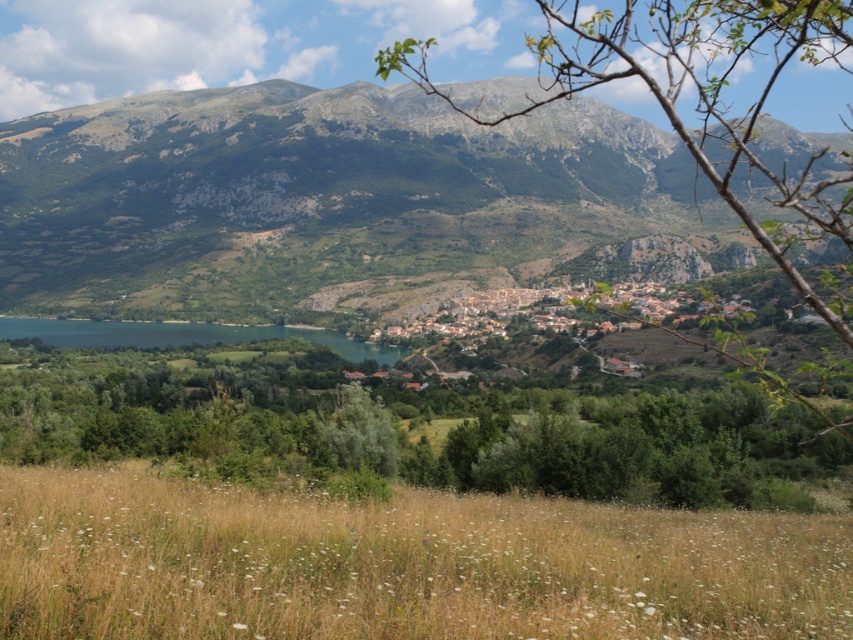
Question: Which object appears farthest from the camera in this image?

Choices:
 (A) blue water at lower left
 (B) dry grass at lower center

Answer: (A)

Question: Which of these objects is positioned farthest from the green textured mountain at upper center?

Choices:
 (A) dry grass at lower center
 (B) brown stone village at center

Answer: (A)

Question: Does dry grass at lower center appear over brown stone village at center?

Choices:
 (A) no
 (B) yes

Answer: (A)

Question: Considering the relative positions of green textured mountain at upper center and dry grass at lower center in the image provided, where is green textured mountain at upper center located with respect to dry grass at lower center?

Choices:
 (A) below
 (B) above

Answer: (B)

Question: Is dry grass at lower center positioned at the back of blue water at lower left?

Choices:
 (A) no
 (B) yes

Answer: (A)

Question: Which object is the farthest from the brown stone village at center?

Choices:
 (A) blue water at lower left
 (B) green textured mountain at upper center

Answer: (B)